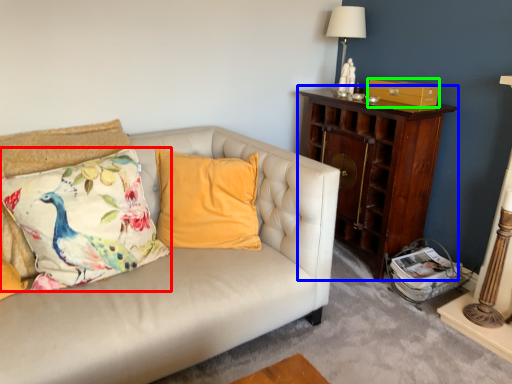
Question: Which is nearer to the pillow (highlighted by a red box)? nightstand (highlighted by a blue box) or drawer (highlighted by a green box).

Choices:
 (A) nightstand
 (B) drawer

Answer: (A)